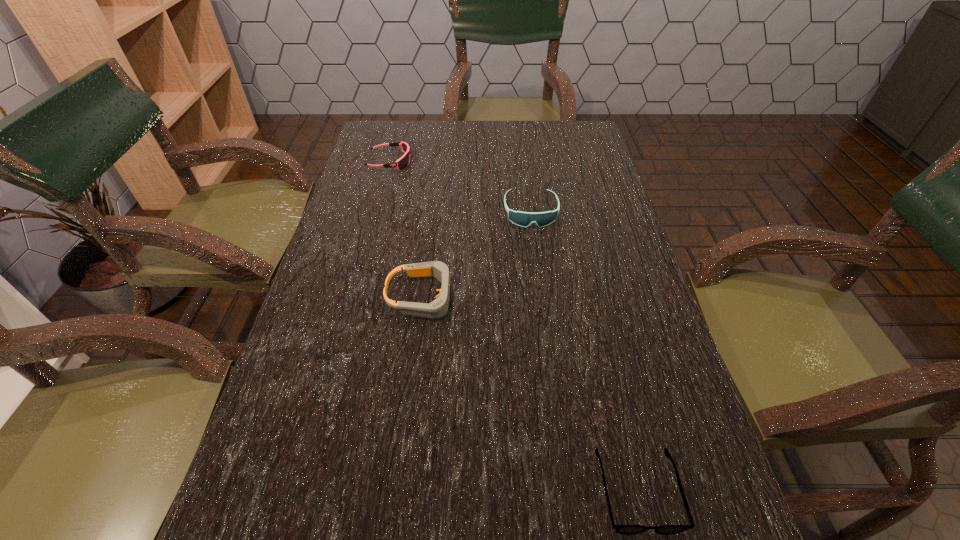
Where is `object located at the far edge`? The height and width of the screenshot is (540, 960). object located at the far edge is located at coordinates (401, 163).

This screenshot has height=540, width=960. Identify the location of object at the left edge. (401, 163).

You are a GUI agent. You are given a task and a screenshot of the screen. Output one action in this format:
    pyautogui.click(x=<x>, y=<y>)
    Task: Click on the object that is at the right edge
    
    Given the screenshot: What is the action you would take?
    pyautogui.click(x=621, y=529)

Locate an element on the screen. object located at the far left corner is located at coordinates (401, 163).

Locate an element on the screen. The width and height of the screenshot is (960, 540). free space at the far edge of the desktop is located at coordinates (499, 147).

Find the location of a particular element. free space at the left edge of the desktop is located at coordinates (343, 258).

In the image, there is a desktop. Identify the location of free region at the right edge. (602, 199).

The height and width of the screenshot is (540, 960). What are the coordinates of `vacant space at the far left corner` in the screenshot? It's located at (374, 123).

Locate an element on the screen. vacant region at the far right corner of the desktop is located at coordinates (576, 137).

Locate an element on the screen. unoccupied area between the leftmost goggles and the spectacles is located at coordinates (514, 327).